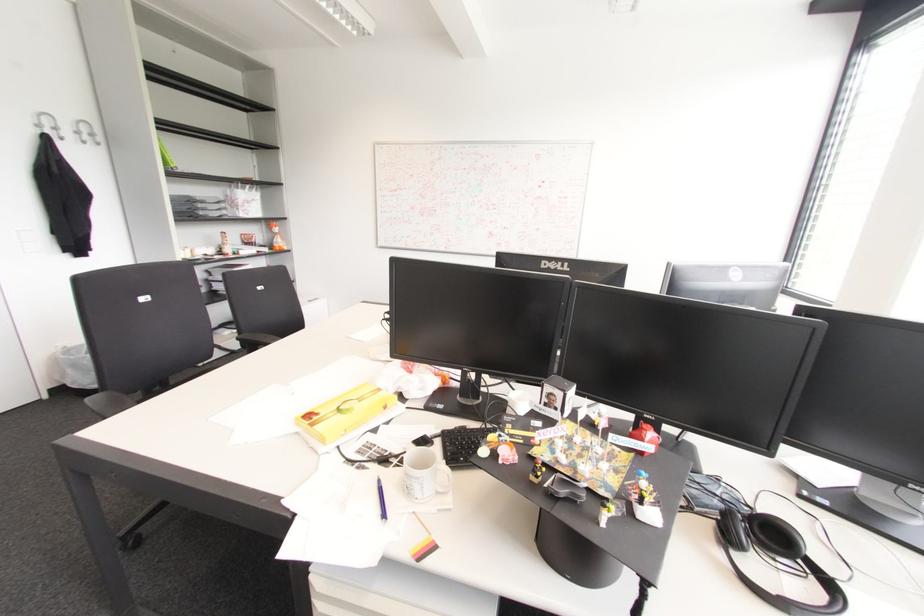
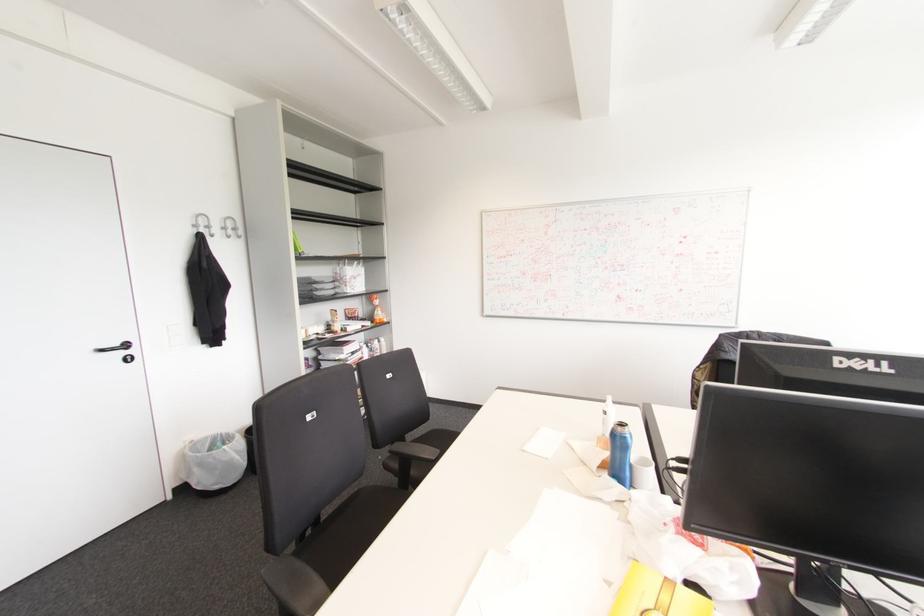
Locate, in the second image, the point that corresponds to [68,370] in the first image.

(195, 469)